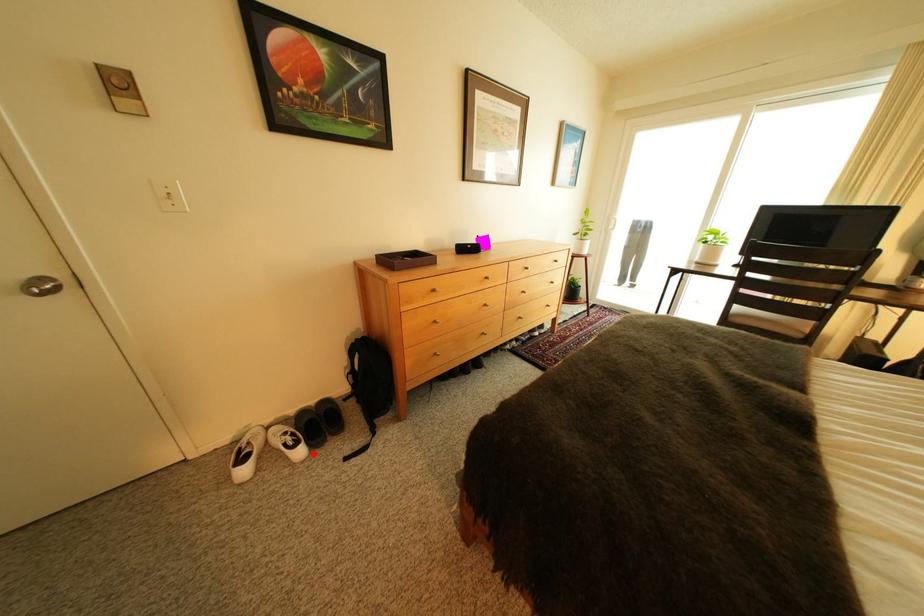
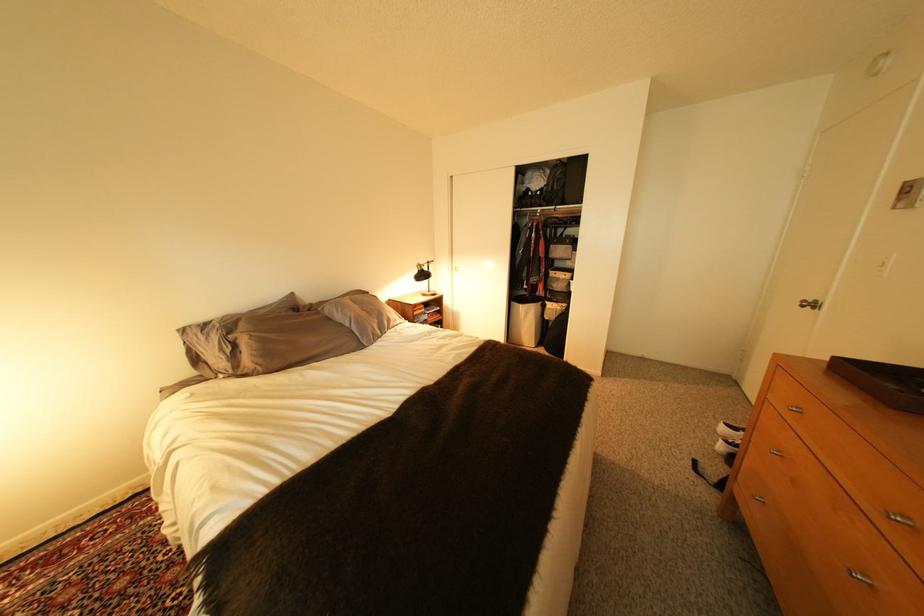
Locate, in the second image, the point that corresponds to the highlighted location in the first image.

(734, 448)